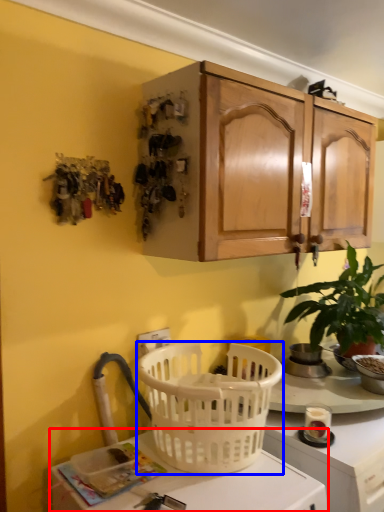
Question: Among these objects, which one is nearest to the camera, desk (highlighted by a red box) or picnic basket (highlighted by a blue box)?

Choices:
 (A) desk
 (B) picnic basket

Answer: (A)